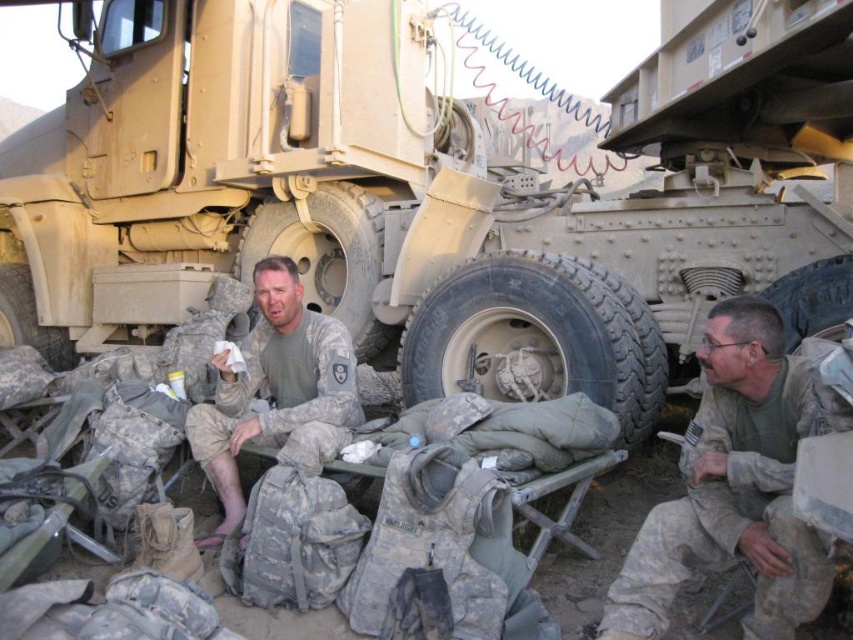
Does rubber/textured tire at center appear on the left side of camouflage rubber tire at lower left?

No, rubber/textured tire at center is not to the left of camouflage rubber tire at lower left.

Based on the photo, between rubber/textured tire at center and camouflage rubber tire at lower left, which one appears on the left side from the viewer's perspective?

camouflage rubber tire at lower left

The width and height of the screenshot is (853, 640). Identify the location of rubber/textured tire at center. (811, 298).

Is point (270, 340) more distant than point (340, 248)?

No.

Identify the location of camouflage fabric uniform at center. (276, 392).

Can you confirm if black rubber tire at center is wider than camouflage fabric uniform at center?

Indeed, black rubber tire at center has a greater width compared to camouflage fabric uniform at center.

Does black rubber tire at center appear over camouflage fabric uniform at center?

Yes.

Where is `black rubber tire at center`? The width and height of the screenshot is (853, 640). black rubber tire at center is located at coordinates (537, 337).

I want to click on black rubber tire at center, so click(537, 337).